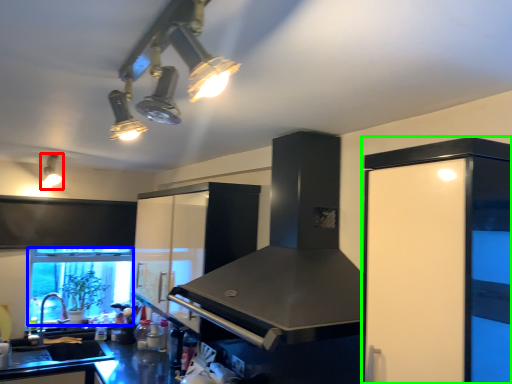
Question: Which object is positioned farthest from light fixture (highlighted by a red box)? Select from window screen (highlighted by a blue box) and cabinetry (highlighted by a green box).

Choices:
 (A) window screen
 (B) cabinetry

Answer: (B)